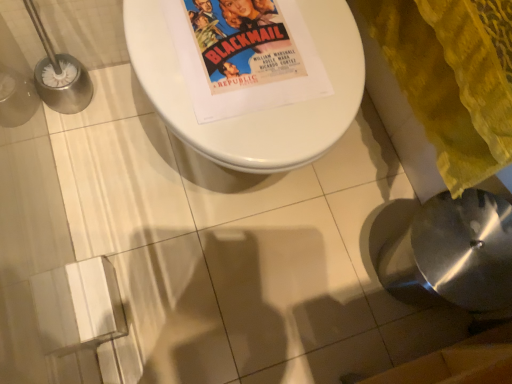
Question: From a real-world perspective, is satin silver sink at lower right positioned over yellow textured blanket at lower right based on gravity?

Choices:
 (A) yes
 (B) no

Answer: (B)

Question: Can you confirm if satin silver sink at lower right is smaller than yellow textured blanket at lower right?

Choices:
 (A) no
 (B) yes

Answer: (B)

Question: Is satin silver sink at lower right facing towards yellow textured blanket at lower right?

Choices:
 (A) no
 (B) yes

Answer: (A)

Question: Is satin silver sink at lower right positioned in front of yellow textured blanket at lower right?

Choices:
 (A) yes
 (B) no

Answer: (B)

Question: Is satin silver sink at lower right oriented away from yellow textured blanket at lower right?

Choices:
 (A) no
 (B) yes

Answer: (A)

Question: From the image's perspective, does satin silver sink at lower right appear higher than yellow textured blanket at lower right?

Choices:
 (A) yes
 (B) no

Answer: (B)

Question: From the image's perspective, would you say satin silver sink at lower right is positioned over white glossy toilet at center?

Choices:
 (A) yes
 (B) no

Answer: (B)

Question: Is satin silver sink at lower right further to the viewer compared to white glossy toilet at center?

Choices:
 (A) yes
 (B) no

Answer: (A)

Question: Can white glossy toilet at center be found inside satin silver sink at lower right?

Choices:
 (A) yes
 (B) no

Answer: (B)

Question: Does satin silver sink at lower right have a lesser height compared to white glossy toilet at center?

Choices:
 (A) yes
 (B) no

Answer: (B)

Question: Is satin silver sink at lower right far from white glossy toilet at center?

Choices:
 (A) no
 (B) yes

Answer: (A)

Question: From the image's perspective, would you say satin silver sink at lower right is shown under white glossy toilet at center?

Choices:
 (A) yes
 (B) no

Answer: (A)

Question: Considering the relative sizes of yellow textured blanket at lower right and white glossy toilet at center in the image provided, is yellow textured blanket at lower right taller than white glossy toilet at center?

Choices:
 (A) yes
 (B) no

Answer: (A)